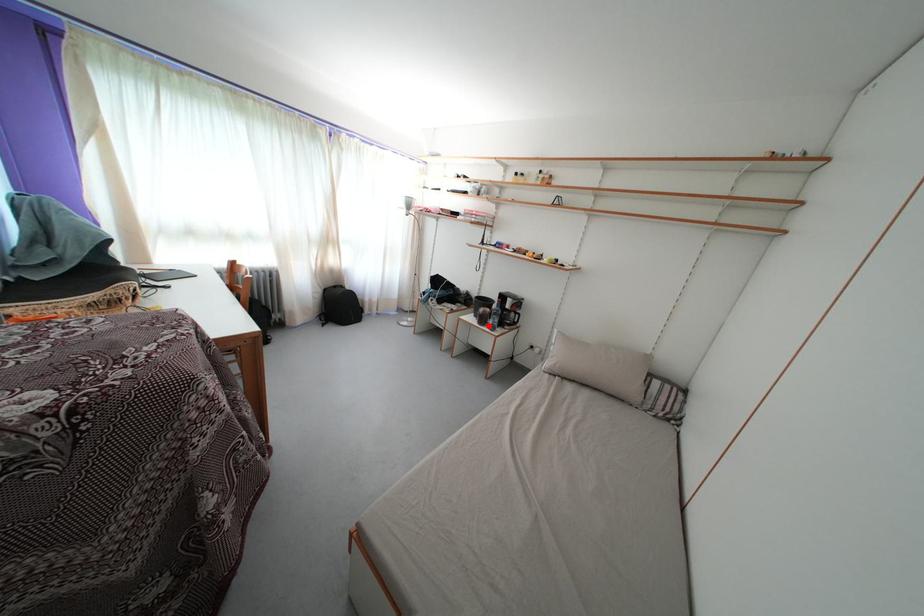
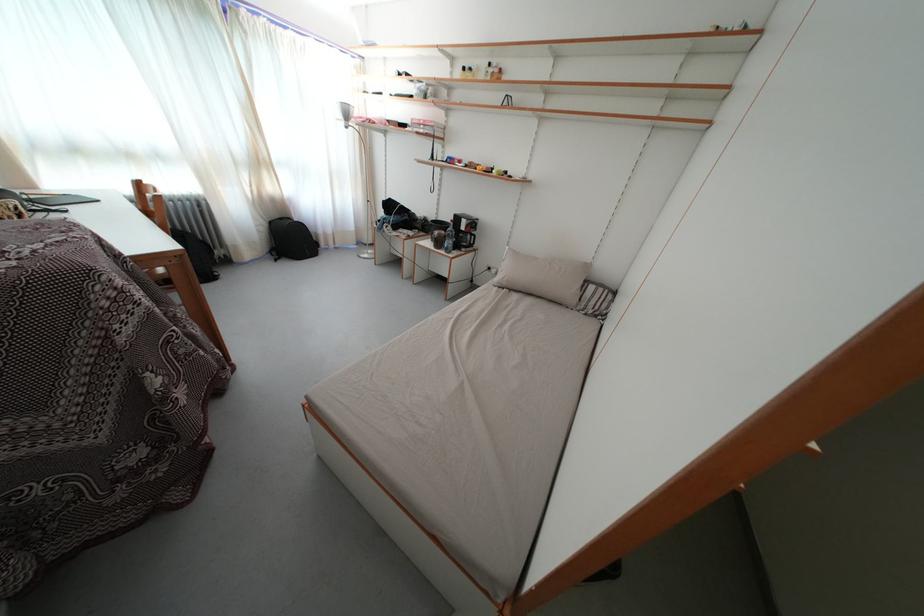
In the second image, find the point that corresponds to the highlighted location in the first image.

(444, 249)